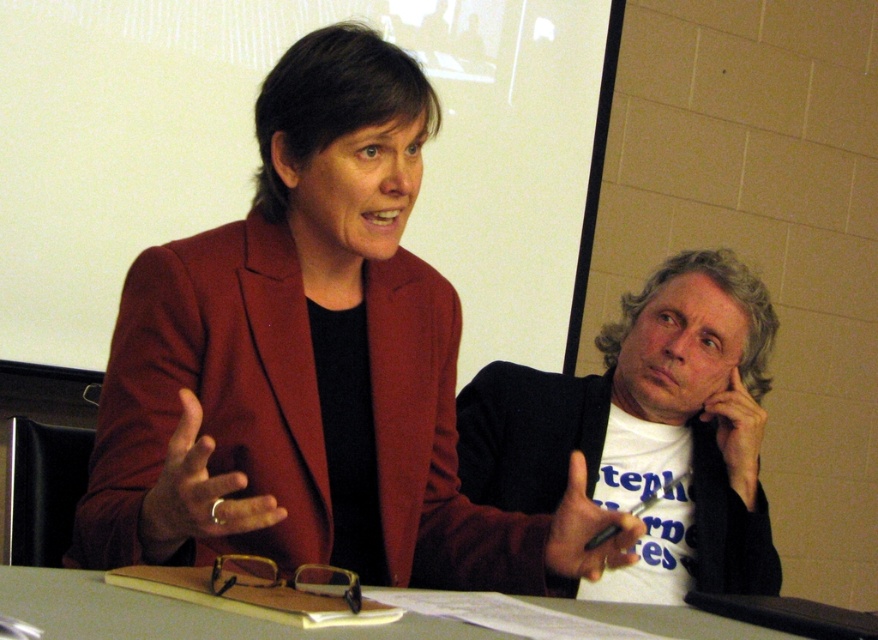
You are a photographer trying to capture a closeup of the black matte pen at center without including the matte red jacket at center in the frame. Is this possible based on their positions?

The matte red jacket at center is closer to the viewer than the black matte pen at center, so it would block the view of the pen. Therefore, capturing a closeup of the black matte pen at center without including the matte red jacket at center is not possible.